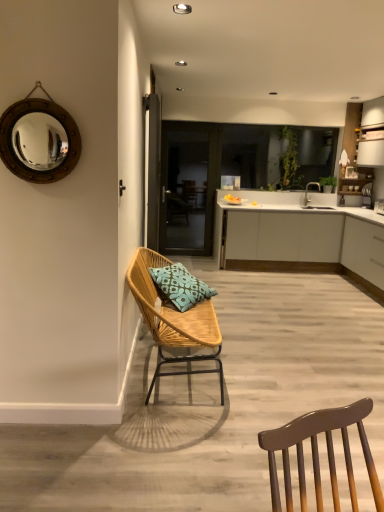
Describe the element at coordinates (39, 140) in the screenshot. I see `wooden frame mirror at upper left` at that location.

In order to face white matte cabinet at right, placed as the 2th cabinetry when sorted from back to front, should I rotate leftwards or rightwards?

Turn right by 24.322 degrees to look at white matte cabinet at right, placed as the 2th cabinetry when sorted from back to front.

At what (x,y) coordinates should I click in order to perform the action: click on teal fabric pillow at center. Please return your answer as a coordinate pair (x, y). This screenshot has height=512, width=384. Looking at the image, I should click on (180, 286).

Locate an element on the screen. transparent glass door at center is located at coordinates (188, 186).

Image resolution: width=384 pixels, height=512 pixels. In order to click on wooden frame mirror at upper left in this screenshot , I will do `click(39, 140)`.

Which is more to the left, wooden frame mirror at upper left or woven wood chair with blue patterned cushion at left?

wooden frame mirror at upper left is more to the left.

You are a GUI agent. You are given a task and a screenshot of the screen. Output one action in this format:
    pyautogui.click(x=<x>, y=<y>)
    Task: Click on the mirror that appears on the left of woven wood chair with blue patterned cushion at left
    The image size is (384, 512).
    Given the screenshot: What is the action you would take?
    pyautogui.click(x=39, y=140)

Is point (46, 173) more distant than point (144, 263)?

No, it is in front of (144, 263).

Which object is wider, wooden frame mirror at upper left or woven wood chair with blue patterned cushion at left?

woven wood chair with blue patterned cushion at left is wider.

From a real-world perspective, between wooden frame mirror at upper left and teal fabric pillow at center, who is vertically lower?

In real-world perspective, teal fabric pillow at center is lower.

Looking at this image, could you tell me if wooden frame mirror at upper left is turned towards teal fabric pillow at center?

No, wooden frame mirror at upper left is not facing towards teal fabric pillow at center.

How distant is wooden frame mirror at upper left from teal fabric pillow at center?

wooden frame mirror at upper left and teal fabric pillow at center are 4.38 feet apart.

Is teal fabric pillow at center inside wooden frame mirror at upper left?

No.

Which is in front, point (10, 106) or point (180, 218)?

Positioned in front is point (10, 106).

Is wooden frame mirror at upper left oriented towards transparent glass door at center?

No, wooden frame mirror at upper left is not facing towards transparent glass door at center.

From a real-world perspective, is wooden frame mirror at upper left over transparent glass door at center?

Yes, from a real-world perspective, wooden frame mirror at upper left is above transparent glass door at center.

Is woven wood chair with blue patterned cushion at left far away from transparent glass door at center?

Yes, woven wood chair with blue patterned cushion at left and transparent glass door at center are quite far apart.

Is woven wood chair with blue patterned cushion at left smaller than transparent glass door at center?

No, woven wood chair with blue patterned cushion at left is not smaller than transparent glass door at center.

From a real-world perspective, is woven wood chair with blue patterned cushion at left under transparent glass door at center?

Yes.

Locate an element on the screen. This screenshot has height=512, width=384. chair lying on the left of transparent glass door at center is located at coordinates (173, 320).

Is white matte cabinet at center, acting as the first cabinetry starting from the back, aimed at teal fabric pillow at center?

Yes, white matte cabinet at center, acting as the first cabinetry starting from the back, is turned towards teal fabric pillow at center.

Between white matte cabinet at center, acting as the first cabinetry starting from the back, and teal fabric pillow at center, which one has smaller width?

With smaller width is teal fabric pillow at center.

Is white matte cabinet at center, acting as the first cabinetry starting from the back, at the left side of teal fabric pillow at center?

In fact, white matte cabinet at center, acting as the first cabinetry starting from the back, is to the right of teal fabric pillow at center.

From the image's perspective, is white matte cabinet at right, placed as the 2th cabinetry when sorted from back to front, above teal fabric pillow at center?

Yes, from the image's perspective, white matte cabinet at right, placed as the 2th cabinetry when sorted from back to front, is on top of teal fabric pillow at center.

Would you consider white matte cabinet at right, which is counted as the first cabinetry, starting from the front, to be distant from teal fabric pillow at center?

Yes, white matte cabinet at right, which is counted as the first cabinetry, starting from the front, and teal fabric pillow at center are quite far apart.

Considering the sizes of objects white matte cabinet at right, placed as the 2th cabinetry when sorted from back to front, and teal fabric pillow at center in the image provided, who is taller, white matte cabinet at right, placed as the 2th cabinetry when sorted from back to front, or teal fabric pillow at center?

white matte cabinet at right, placed as the 2th cabinetry when sorted from back to front.

Considering the positions of objects white matte cabinet at right, which is counted as the first cabinetry, starting from the front, and teal fabric pillow at center in the image provided, who is more to the left, white matte cabinet at right, which is counted as the first cabinetry, starting from the front, or teal fabric pillow at center?

Positioned to the left is teal fabric pillow at center.

Locate an element on the screen. Image resolution: width=384 pixels, height=512 pixels. chair that is below the teal fabric pillow at center (from the image's perspective) is located at coordinates (173, 320).

Which object is wider, teal fabric pillow at center or woven wood chair with blue patterned cushion at left?

With larger width is woven wood chair with blue patterned cushion at left.

Does point (190, 275) come behind point (136, 290)?

That is True.

Is woven wood chair with blue patterned cushion at left a part of teal fabric pillow at center?

Actually, woven wood chair with blue patterned cushion at left is outside teal fabric pillow at center.

You are a GUI agent. You are given a task and a screenshot of the screen. Output one action in this format:
    pyautogui.click(x=<x>, y=<y>)
    Task: Click on the chair below the wooden frame mirror at upper left (from the image's perspective)
    
    Given the screenshot: What is the action you would take?
    pyautogui.click(x=173, y=320)

Where is `pillow behind the wooden frame mirror at upper left`? This screenshot has height=512, width=384. pillow behind the wooden frame mirror at upper left is located at coordinates (180, 286).

From the picture: Considering their positions, is white matte cabinet at center, acting as the first cabinetry starting from the back, positioned further to woven wood chair with blue patterned cushion at left than wooden frame mirror at upper left?

white matte cabinet at center, acting as the first cabinetry starting from the back, lies further to woven wood chair with blue patterned cushion at left than the other object.

Which object lies nearer to the anchor point woven wood chair with blue patterned cushion at left, transparent glass door at center or white matte cabinet at center, acting as the first cabinetry starting from the back?

white matte cabinet at center, acting as the first cabinetry starting from the back.

Based on their spatial positions, is transparent glass door at center or wooden frame mirror at upper left closer to white matte cabinet at center, the 2th cabinetry in the front-to-back sequence?

Based on the image, transparent glass door at center appears to be nearer to white matte cabinet at center, the 2th cabinetry in the front-to-back sequence.

Consider the image. When comparing their distances from wooden frame mirror at upper left, does woven wood chair with blue patterned cushion at left or transparent glass door at center seem further?

Among the two, transparent glass door at center is located further to wooden frame mirror at upper left.

Estimate the real-world distances between objects in this image. Which object is further from transparent glass door at center, teal fabric pillow at center or white matte cabinet at right, which is counted as the first cabinetry, starting from the front?

teal fabric pillow at center is further to transparent glass door at center.

When comparing their distances from white matte cabinet at right, which is counted as the first cabinetry, starting from the front, does white matte cabinet at center, the 2th cabinetry in the front-to-back sequence, or woven wood chair with blue patterned cushion at left seem further?

The object further to white matte cabinet at right, which is counted as the first cabinetry, starting from the front, is woven wood chair with blue patterned cushion at left.

Considering their positions, is wooden frame mirror at upper left positioned closer to teal fabric pillow at center than white matte cabinet at right, which is counted as the first cabinetry, starting from the front?

The object closer to teal fabric pillow at center is wooden frame mirror at upper left.

Estimate the real-world distances between objects in this image. Which object is further from transparent glass door at center, teal fabric pillow at center or white matte cabinet at center, acting as the first cabinetry starting from the back?

teal fabric pillow at center lies further to transparent glass door at center than the other object.

Identify the location of chair located between wooden frame mirror at upper left and white matte cabinet at center, the 2th cabinetry in the front-to-back sequence, in the depth direction. This screenshot has width=384, height=512. (173, 320).

The image size is (384, 512). Find the location of `cabinetry positioned between woven wood chair with blue patterned cushion at left and white matte cabinet at center, acting as the first cabinetry starting from the back, from near to far`. cabinetry positioned between woven wood chair with blue patterned cushion at left and white matte cabinet at center, acting as the first cabinetry starting from the back, from near to far is located at coordinates (364, 250).

At what (x,y) coordinates should I click in order to perform the action: click on pillow between wooden frame mirror at upper left and white matte cabinet at center, acting as the first cabinetry starting from the back, in the front-back direction. Please return your answer as a coordinate pair (x, y). Image resolution: width=384 pixels, height=512 pixels. Looking at the image, I should click on (180, 286).

At what (x,y) coordinates should I click in order to perform the action: click on chair located between wooden frame mirror at upper left and white matte cabinet at right, placed as the 2th cabinetry when sorted from back to front, in the left-right direction. Please return your answer as a coordinate pair (x, y). The height and width of the screenshot is (512, 384). Looking at the image, I should click on (173, 320).